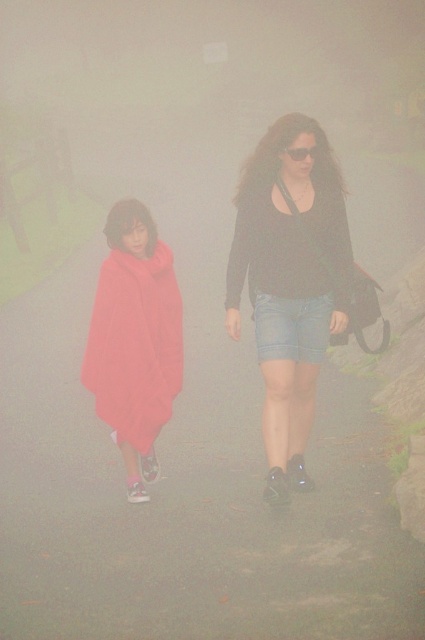
Can you confirm if denim shorts at center is positioned to the right of matte red blanket at left?

Indeed, denim shorts at center is positioned on the right side of matte red blanket at left.

Does point (283, 224) come closer to viewer compared to point (130, 353)?

That is True.

Who is more forward, (345, 326) or (176, 298)?

Point (345, 326)

Find the location of `denim shorts at center`. denim shorts at center is located at coordinates [x=289, y=280].